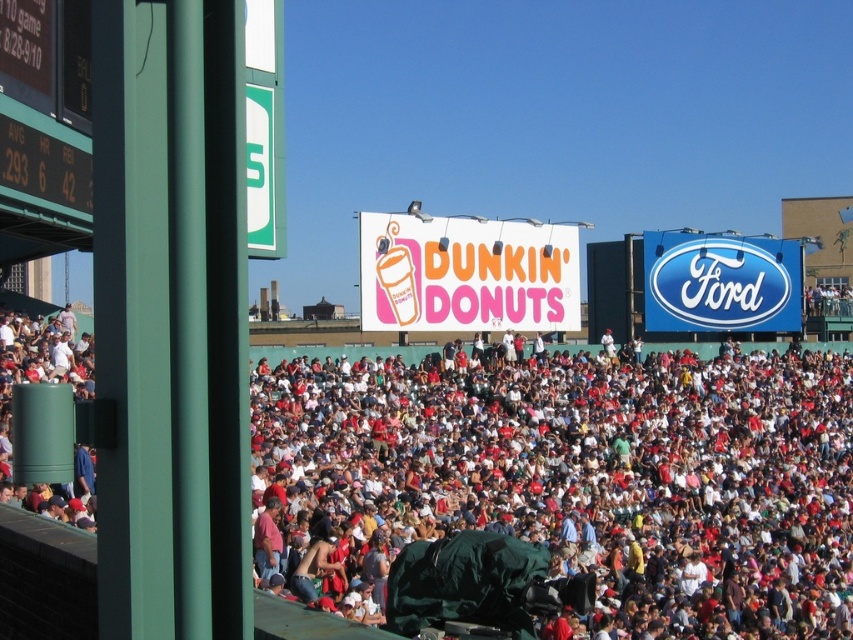
Consider the image. Is white cotton crowd at center positioned in front of green digital scoreboard at left?

Yes.

Can you confirm if white cotton crowd at center is smaller than green digital scoreboard at left?

Actually, white cotton crowd at center might be larger than green digital scoreboard at left.

Locate an element on the screen. Image resolution: width=853 pixels, height=640 pixels. white cotton crowd at center is located at coordinates (572, 483).